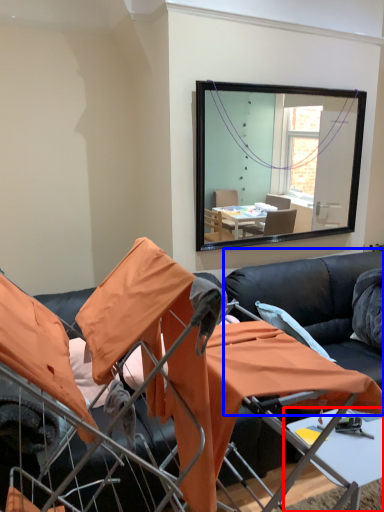
Question: Which object appears closest to the camera in this image, table (highlighted by a red box) or couch (highlighted by a blue box)?

Choices:
 (A) table
 (B) couch

Answer: (A)